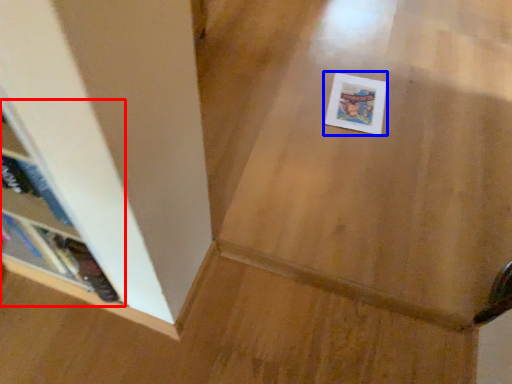
Question: Which point is closer to the camera, shelf (highlighted by a red box) or postcard (highlighted by a blue box)?

Choices:
 (A) shelf
 (B) postcard

Answer: (A)